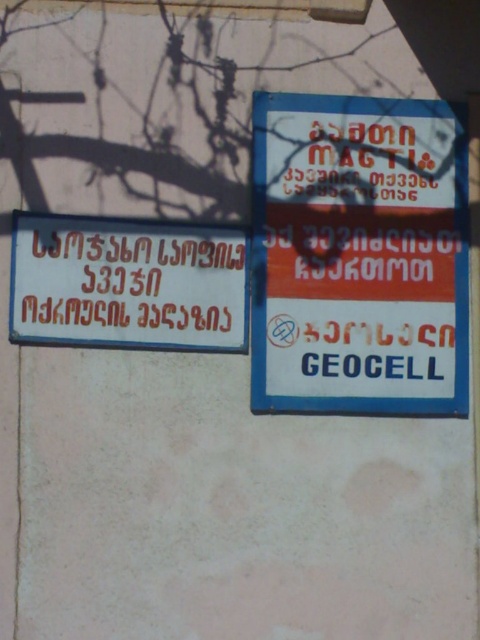
Question: Which object appears farthest from the camera in this image?

Choices:
 (A) matte red sign at center
 (B) blue plastic sign at upper right

Answer: (B)

Question: Is blue plastic sign at upper right positioned before matte red sign at center?

Choices:
 (A) no
 (B) yes

Answer: (A)

Question: Which object is closer to the camera taking this photo?

Choices:
 (A) blue plastic sign at upper right
 (B) matte red sign at center

Answer: (B)

Question: Is blue plastic sign at upper right below matte red sign at center?

Choices:
 (A) yes
 (B) no

Answer: (B)

Question: Is blue plastic sign at upper right wider than matte red sign at center?

Choices:
 (A) yes
 (B) no

Answer: (B)